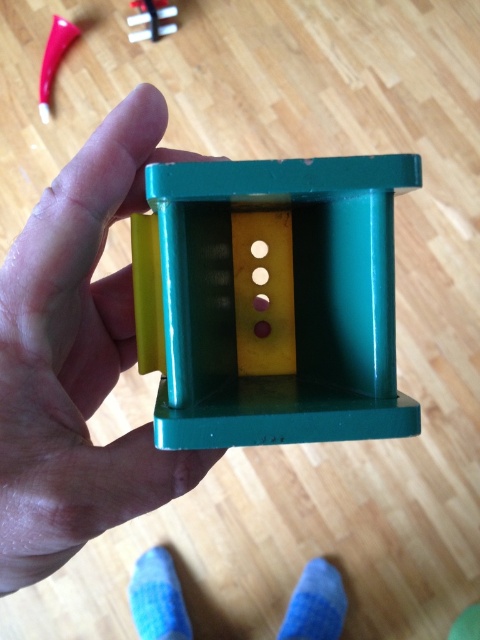
Between blue fuzzy sock at lower center and matte plastic toy at upper center, which one appears on the right side from the viewer's perspective?

Positioned to the right is blue fuzzy sock at lower center.

Is the position of blue fuzzy sock at lower center more distant than that of matte plastic toy at upper center?

No, it is not.

Identify the location of blue fuzzy sock at lower center. The image size is (480, 640). (315, 604).

You are a GUI agent. You are given a task and a screenshot of the screen. Output one action in this format:
    pyautogui.click(x=<x>, y=<y>)
    Task: Click on the blue fuzzy sock at lower center
    Image resolution: width=480 pixels, height=640 pixels.
    Given the screenshot: What is the action you would take?
    pyautogui.click(x=315, y=604)

Which of these two, green plastic toy at center or green plastic hand at center, stands shorter?

Standing shorter between the two is green plastic toy at center.

What do you see at coordinates (271, 300) in the screenshot? This screenshot has height=640, width=480. I see `green plastic toy at center` at bounding box center [271, 300].

Who is more distant from viewer, (x=204, y=419) or (x=61, y=472)?

The point (x=61, y=472) is behind.

The image size is (480, 640). Find the location of `green plastic toy at center`. green plastic toy at center is located at coordinates (271, 300).

Who is more distant from viewer, (220, 365) or (136, 592)?

Positioned behind is point (136, 592).

Who is higher up, green plastic toy at center or blue fuzzy sock at lower left?

green plastic toy at center is higher up.

The image size is (480, 640). In order to click on green plastic toy at center in this screenshot , I will do `click(271, 300)`.